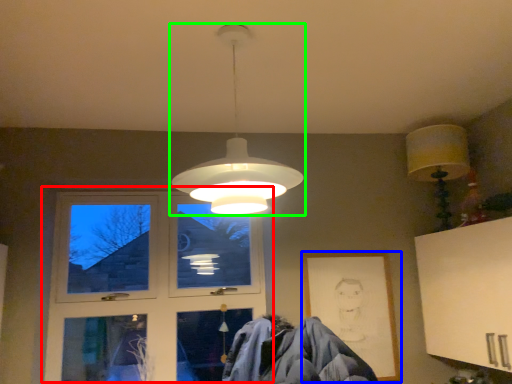
Question: Which object is the closest to the window (highlighted by a red box)? Choose among these: picture frame (highlighted by a blue box) or lamp (highlighted by a green box).

Choices:
 (A) picture frame
 (B) lamp

Answer: (A)